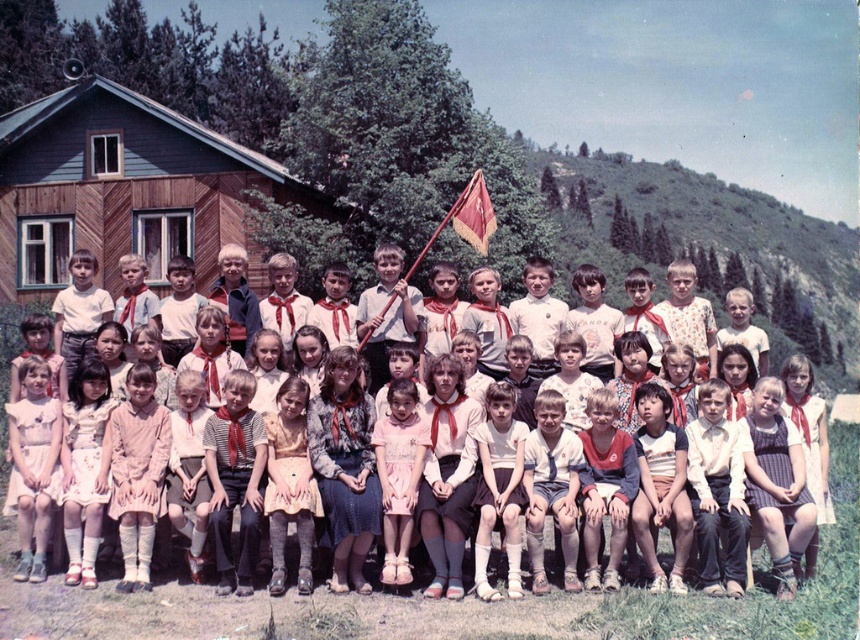
Question: Which object is positioned farthest from the wooden cabin at upper left?

Choices:
 (A) red velvet flag at center
 (B) matte white dress at center
 (C) light yellow fabric dress at center

Answer: (C)

Question: Does matte white dress at center appear under red velvet flag at center?

Choices:
 (A) no
 (B) yes

Answer: (B)

Question: Which point is farther to the camera?

Choices:
 (A) (484, 227)
 (B) (23, 314)
 (C) (309, 508)
 (D) (225, 236)

Answer: (D)

Question: Does light yellow fabric dress at center have a lesser width compared to red velvet flag at center?

Choices:
 (A) no
 (B) yes

Answer: (A)

Question: Does light yellow fabric dress at center appear over matte white dress at center?

Choices:
 (A) yes
 (B) no

Answer: (B)

Question: Which object is farther from the camera taking this photo?

Choices:
 (A) matte white dress at center
 (B) light yellow fabric dress at center
 (C) wooden cabin at upper left

Answer: (C)